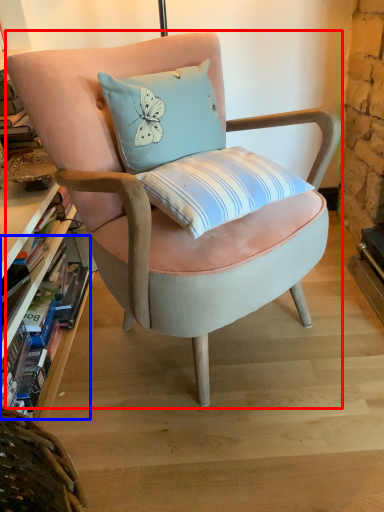
Question: Which object is closer to the camera taking this photo, chair (highlighted by a red box) or book (highlighted by a blue box)?

Choices:
 (A) chair
 (B) book

Answer: (A)